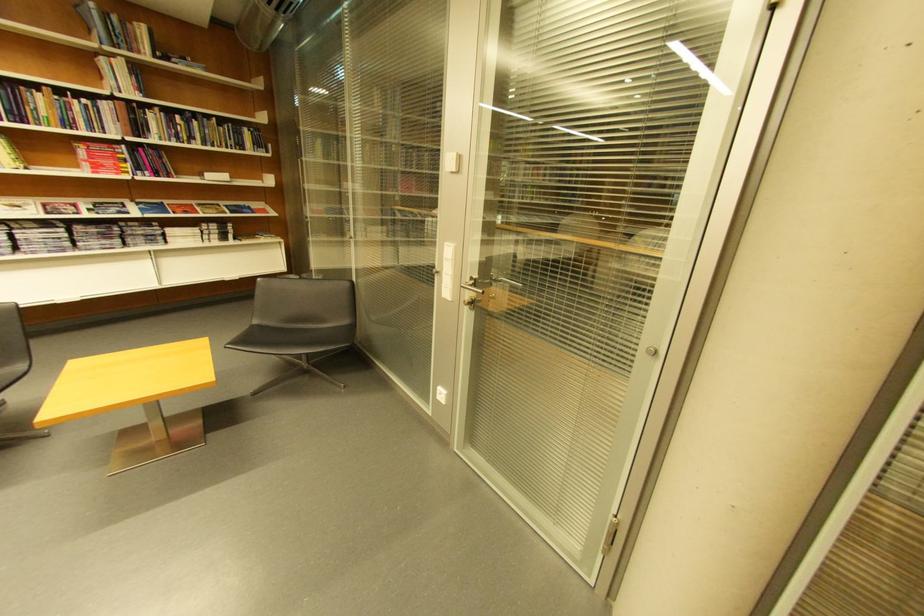
Where would you pull the silver door handle? Please return your answer as a coordinate pair (x, y).

(471, 294)